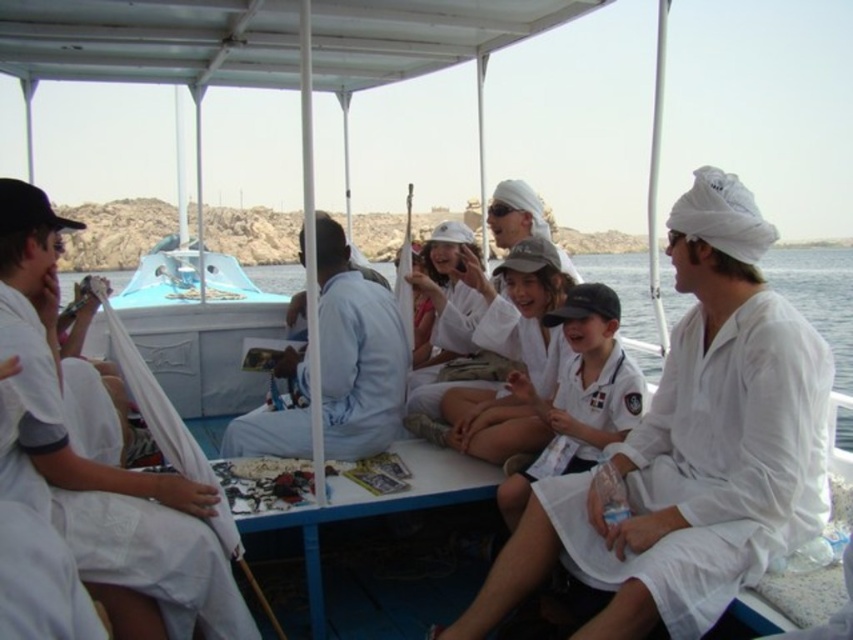
Is white cotton robe at right thinner than white cotton robe at center?

Incorrect, white cotton robe at right's width is not less than white cotton robe at center's.

Between white cotton robe at right and white cotton robe at center, which one is positioned higher?

white cotton robe at center

Is point (683, 452) more distant than point (606, 364)?

No, (683, 452) is closer to viewer.

Locate an element on the screen. This screenshot has width=853, height=640. white cotton robe at right is located at coordinates (717, 464).

Is white cotton robe at right wider than light blue fabric at center?

No.

Is white cotton robe at right bigger than light blue fabric at center?

No.

Measure the distance between white cotton robe at right and camera.

They are 112.87 feet apart.

At what (x,y) coordinates should I click in order to perform the action: click on white cotton robe at right. Please return your answer as a coordinate pair (x, y). The image size is (853, 640). Looking at the image, I should click on (717, 464).

Does point (144, 582) come behind point (589, 460)?

No, it is not.

Between white cotton robe at left and white cotton robe at center, which one appears on the left side from the viewer's perspective?

From the viewer's perspective, white cotton robe at left appears more on the left side.

Who is more distant from viewer, (9, 385) or (618, 403)?

The point (618, 403) is behind.

You are a GUI agent. You are given a task and a screenshot of the screen. Output one action in this format:
    pyautogui.click(x=<x>, y=<y>)
    Task: Click on the white cotton robe at left
    The image size is (853, 640).
    Given the screenshot: What is the action you would take?
    pyautogui.click(x=107, y=500)